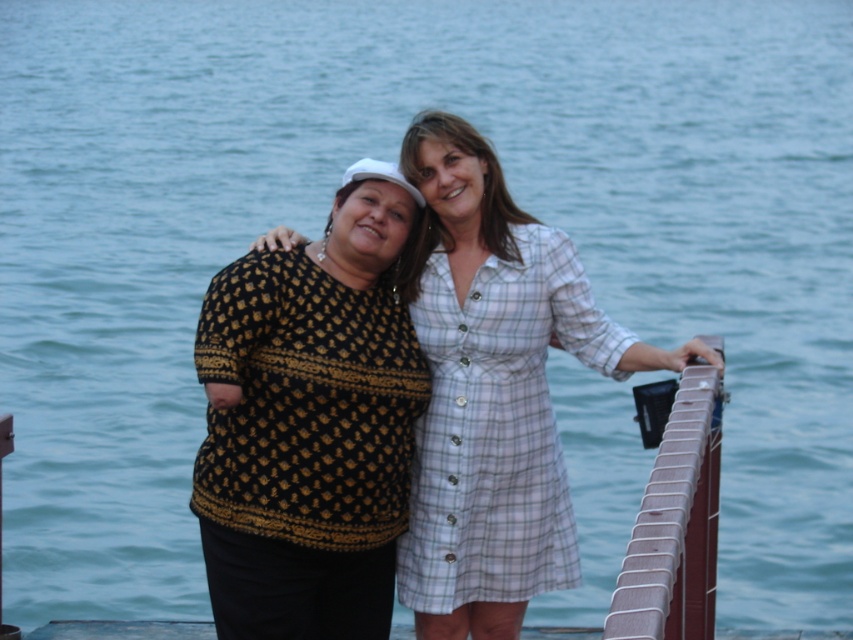
The height and width of the screenshot is (640, 853). What do you see at coordinates (494, 390) in the screenshot?
I see `black textured sweater at center` at bounding box center [494, 390].

Does black textured sweater at center appear under light blue plaid dress at center?

Incorrect, black textured sweater at center is not positioned below light blue plaid dress at center.

Which is in front, point (526, 266) or point (550, 426)?

Point (526, 266) is more forward.

Where is `black textured sweater at center`? Image resolution: width=853 pixels, height=640 pixels. black textured sweater at center is located at coordinates (494, 390).

Is black textured sweater at center positioned in front of brown wooden rail at right?

No, black textured sweater at center is further to the viewer.

Can you confirm if black textured sweater at center is thinner than brown wooden rail at right?

In fact, black textured sweater at center might be wider than brown wooden rail at right.

Does point (479, 193) come farther from viewer compared to point (688, 612)?

Yes, it is behind point (688, 612).

Locate an element on the screen. The width and height of the screenshot is (853, 640). black textured sweater at center is located at coordinates (494, 390).

Can you confirm if black knitwear at center is smaller than light blue plaid dress at center?

No, black knitwear at center is not smaller than light blue plaid dress at center.

Find the location of `black knitwear at center`. black knitwear at center is located at coordinates (310, 422).

Where is `black knitwear at center`? This screenshot has height=640, width=853. black knitwear at center is located at coordinates (310, 422).

This screenshot has height=640, width=853. What are the coordinates of `black knitwear at center` in the screenshot? It's located at (310, 422).